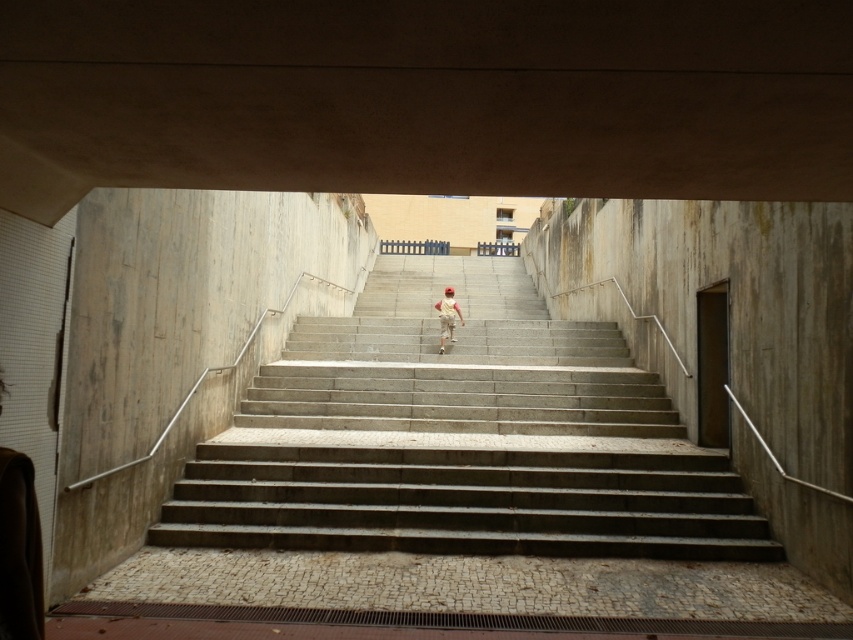
Question: Does concrete stairs at center come behind light beige fabric pants at center?

Choices:
 (A) yes
 (B) no

Answer: (B)

Question: Does concrete stairs at center come in front of light beige fabric pants at center?

Choices:
 (A) yes
 (B) no

Answer: (A)

Question: Which object appears farthest from the camera in this image?

Choices:
 (A) light beige fabric pants at center
 (B) concrete stairs at center

Answer: (A)

Question: Among these objects, which one is farthest from the camera?

Choices:
 (A) light beige fabric pants at center
 (B) concrete stairs at center

Answer: (A)

Question: Observing the image, what is the correct spatial positioning of concrete stairs at center in reference to light beige fabric pants at center?

Choices:
 (A) below
 (B) above

Answer: (A)

Question: Which object appears closest to the camera in this image?

Choices:
 (A) light beige fabric pants at center
 (B) concrete stairs at center

Answer: (B)